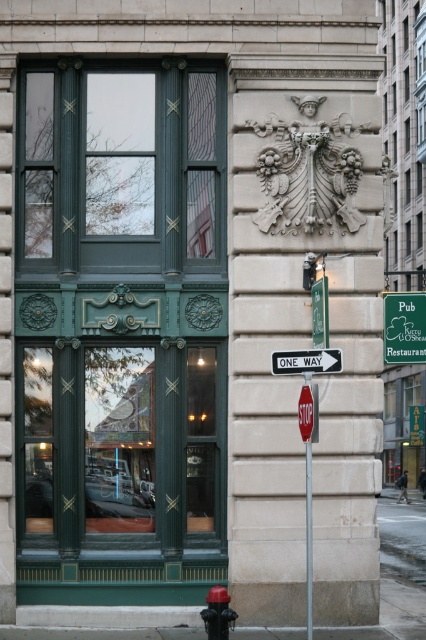
You are standing in front of the building and want to locate the red plastic fire hydrant at lower center. Where exactly would you find it relative to the building facade?

The red plastic fire hydrant at lower center is located at the coordinates point [218,612] on the building facade.

You are standing in front of the building and want to touch both the green matte window at center and the green plastic sign at center right. Which object should you reach for first to touch the closer one?

The green matte window at center is closer to the viewer than the green plastic sign at center right, so you should reach for the green matte window at center first.

You are an architect assessing the building facade. You need to install a new decorative element. The green matte window at center and the white plastic sign at center are both at the center. Which object has a greater width, and thus might be better suited for a wider decoration?

The green matte window at center has a greater width than the white plastic sign at center, so it might be better suited for a wider decoration.